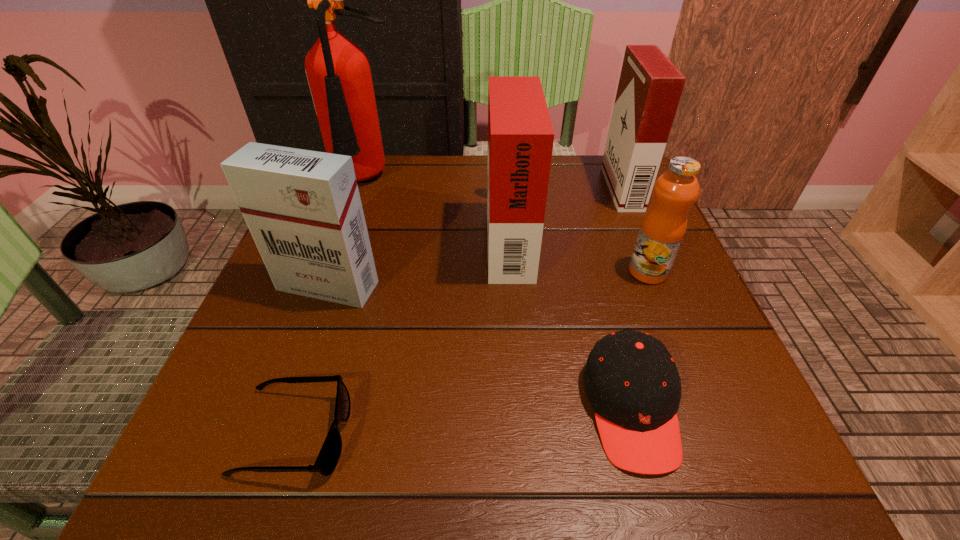
The width and height of the screenshot is (960, 540). In order to click on vacant space that's between the rightmost cigarette case and the fruit juice in this screenshot , I will do `click(635, 230)`.

At what (x,y) coordinates should I click in order to perform the action: click on vacant point located between the fifth object from left to right and the leftmost cigarette case. Please return your answer as a coordinate pair (x, y). Image resolution: width=960 pixels, height=540 pixels. Looking at the image, I should click on (479, 347).

Find the location of a particular element. free spot between the cap and the leftmost cigarette case is located at coordinates (479, 347).

Locate an element on the screen. The width and height of the screenshot is (960, 540). object that is the closest to the fruit juice is located at coordinates coord(631,380).

The width and height of the screenshot is (960, 540). In order to click on the third closest object to the leftmost cigarette case in this screenshot , I will do point(338,71).

Identify which cigarette case is the nearest to the shortest object. Please provide its 2D coordinates. Your answer should be formatted as a tuple, i.e. [(x, y)], where the tuple contains the x and y coordinates of a point satisfying the conditions above.

[(303, 209)]

Identify the location of cigarette case that stands as the second closest to the fruit juice. [x=520, y=135].

Locate an element on the screen. blank space that satisfies the following two spatial constraints: 1. on the front-facing side of the rightmost cigarette case; 2. on the front-facing side of the cap is located at coordinates (713, 408).

Find the location of a particular element. blank space that satisfies the following two spatial constraints: 1. at the nozzle of the fire extinguisher; 2. on the left side of the fruit juice is located at coordinates (336, 272).

You are a GUI agent. You are given a task and a screenshot of the screen. Output one action in this format:
    pyautogui.click(x=<x>, y=<y>)
    Task: Click on the vacant space that satisfies the following two spatial constraints: 1. on the front-facing side of the fourth object from left to right; 2. on the back side of the fruit juice
    Image resolution: width=960 pixels, height=540 pixels.
    Given the screenshot: What is the action you would take?
    pyautogui.click(x=512, y=272)